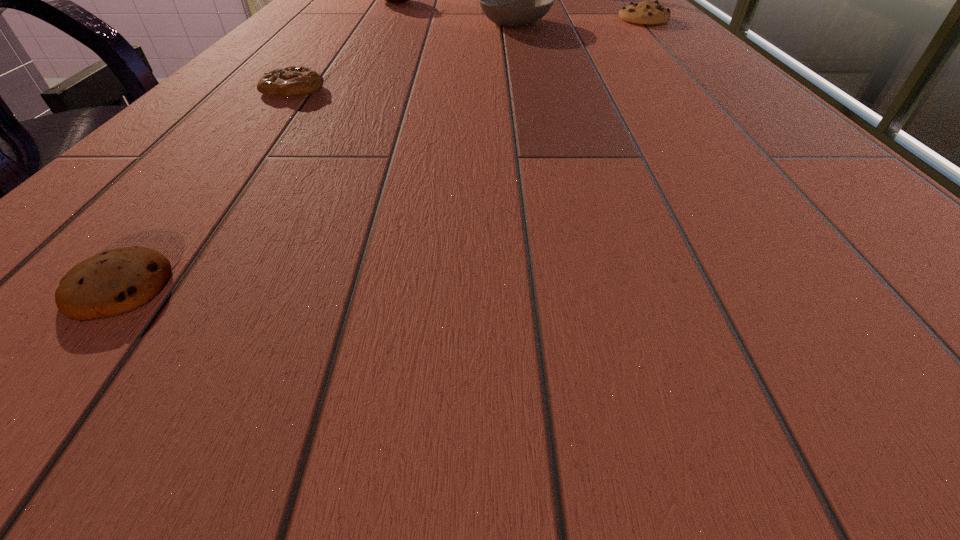
Find the location of a particular element. bowl is located at coordinates (513, 0).

At what (x,y) coordinates should I click in order to perform the action: click on the second object from right to left. Please return your answer as a coordinate pair (x, y). Image resolution: width=960 pixels, height=540 pixels. Looking at the image, I should click on [513, 0].

Where is `the farthest cookie`? the farthest cookie is located at coordinates (645, 12).

Where is `the rightmost object`? the rightmost object is located at coordinates (645, 12).

Find the location of `the second nearest cookie`. the second nearest cookie is located at coordinates (292, 81).

I want to click on the nearest cookie, so click(118, 281).

Locate an element on the screen. This screenshot has width=960, height=540. vacant region located 0.270m on the right of the fourth shortest object is located at coordinates (668, 24).

Locate an element on the screen. This screenshot has height=540, width=960. vacant position located on the left of the third shortest object is located at coordinates (551, 19).

You are a GUI agent. You are given a task and a screenshot of the screen. Output one action in this format:
    pyautogui.click(x=<x>, y=<y>)
    Task: Click on the free spot located on the front of the second nearest cookie
    The image size is (960, 540).
    Given the screenshot: What is the action you would take?
    pyautogui.click(x=214, y=191)

Locate an element on the screen. free space located 0.320m on the back of the nearest object is located at coordinates (260, 116).